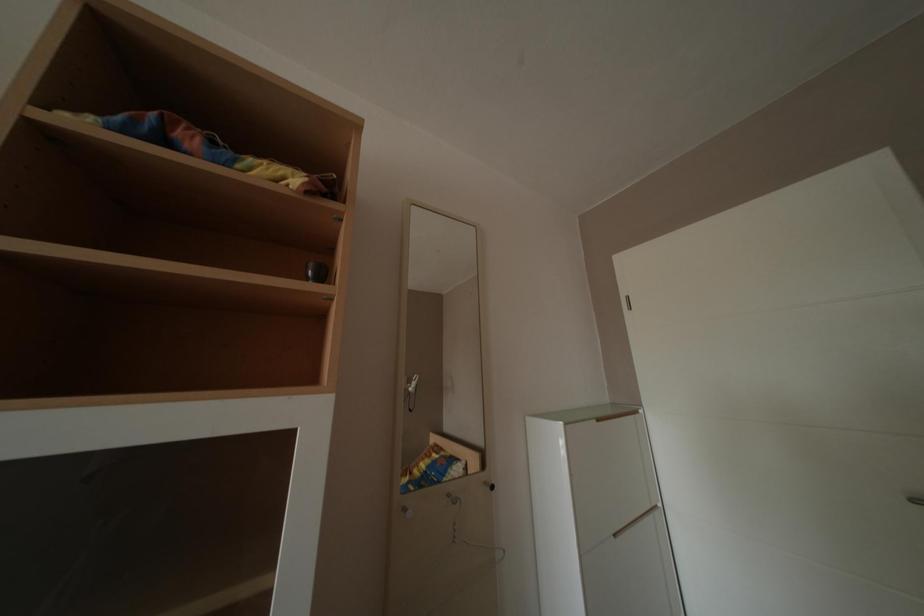
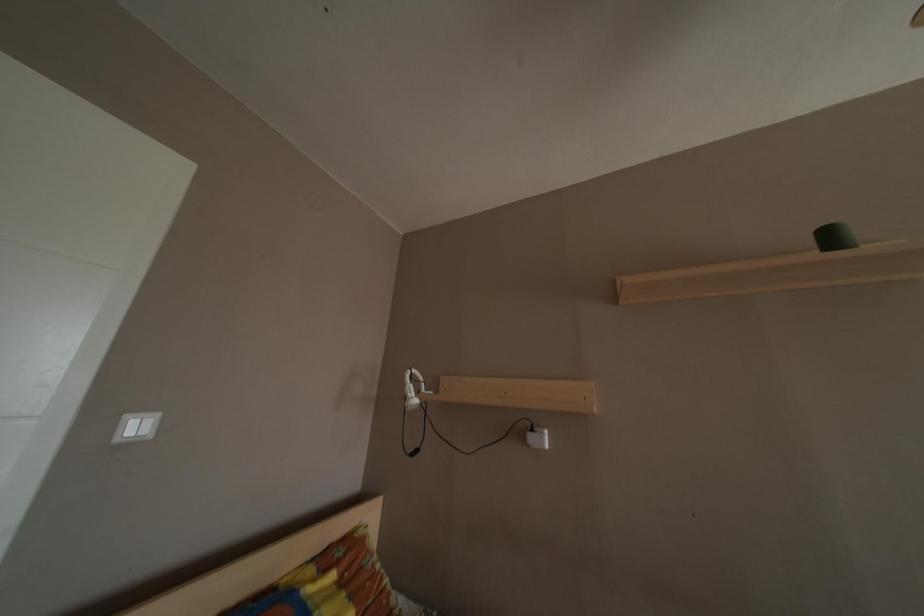
The first image is from the beginning of the video and the second image is from the end. How did the camera likely rotate when shooting the video?

The camera's rotation is toward right-up.